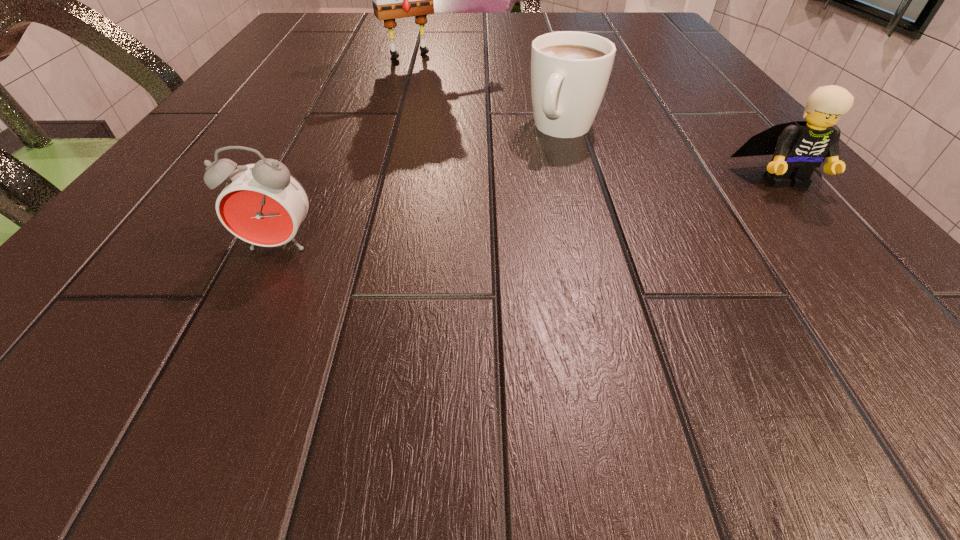
Identify the location of vacant space located with the handle on the side of the third nearest object. This screenshot has height=540, width=960. (462, 281).

Identify the location of blank space located on the face of the tallest object. (462, 98).

This screenshot has height=540, width=960. What are the coordinates of `blank area located on the face of the tallest object` in the screenshot? It's located at (456, 91).

Identify the location of free space located on the face of the tallest object. This screenshot has width=960, height=540. (479, 117).

What are the coordinates of `object located at the far edge` in the screenshot? It's located at (391, 0).

The height and width of the screenshot is (540, 960). I want to click on object at the near edge, so click(262, 203).

At what (x,y) coordinates should I click in order to perform the action: click on object present at the left edge. Please return your answer as a coordinate pair (x, y). The image size is (960, 540). Looking at the image, I should click on (391, 0).

You are a GUI agent. You are given a task and a screenshot of the screen. Output one action in this format:
    pyautogui.click(x=<x>, y=<y>)
    Task: Click on the object situated at the right edge
    Image resolution: width=960 pixels, height=540 pixels.
    Given the screenshot: What is the action you would take?
    pyautogui.click(x=798, y=148)

Where is `object situated at the far left corner`? Image resolution: width=960 pixels, height=540 pixels. object situated at the far left corner is located at coordinates (391, 0).

This screenshot has height=540, width=960. In the image, there is a desktop. Identify the location of vacant space at the far edge. (555, 25).